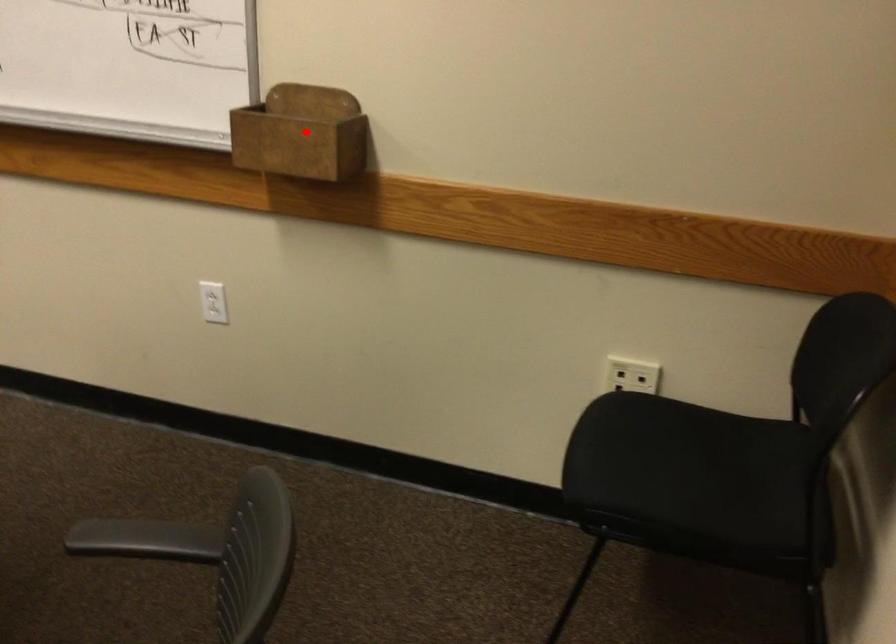
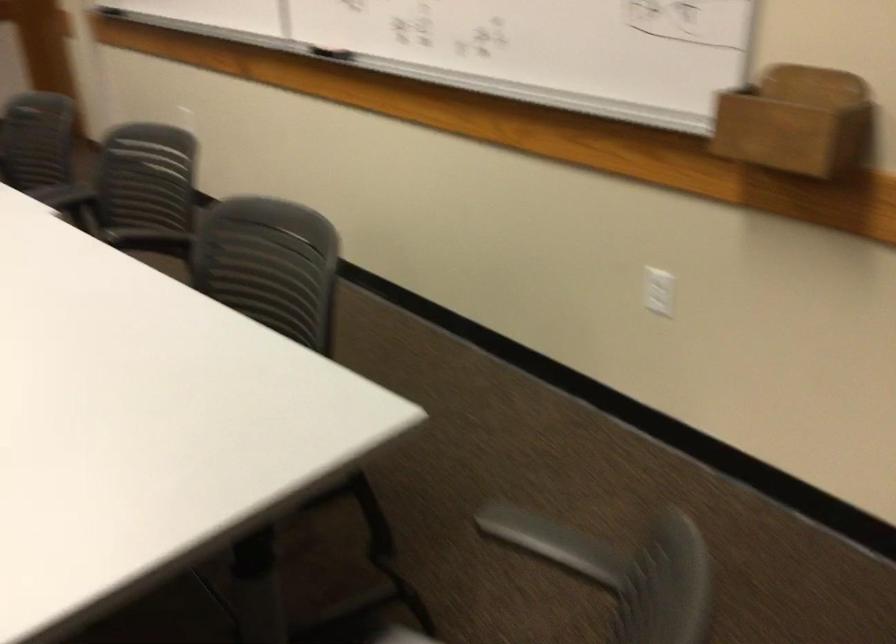
In the second image, find the point that corresponds to the highlighted location in the first image.

(797, 122)